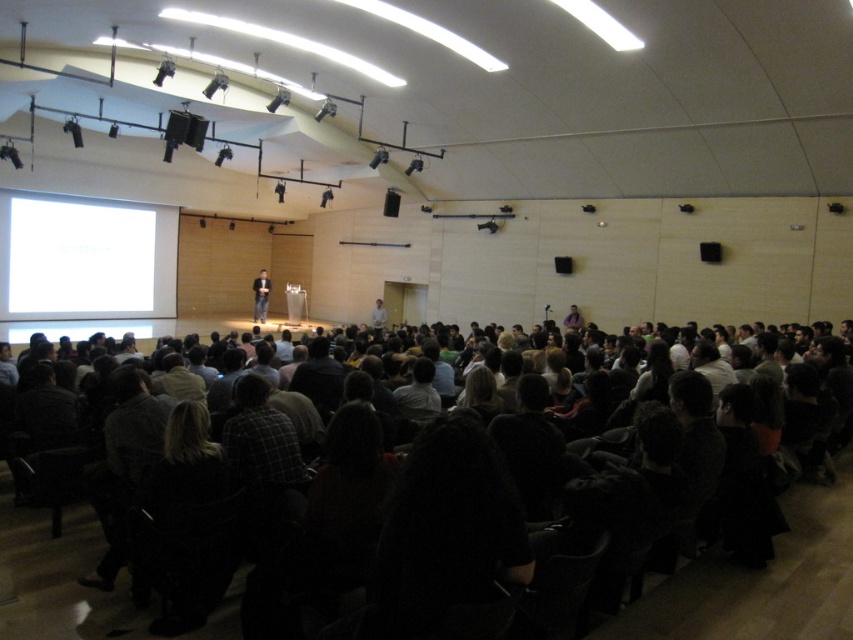
Question: Can you confirm if dark clothing crowd at center is positioned above dark suit at center?

Choices:
 (A) no
 (B) yes

Answer: (A)

Question: Which is nearer to the dark clothing crowd at center?

Choices:
 (A) white glossy projection screen at left
 (B) dark suit at center

Answer: (A)

Question: Which point appears closest to the camera in this image?

Choices:
 (A) (73, 227)
 (B) (260, 285)
 (C) (799, 628)

Answer: (C)

Question: Observing the image, what is the correct spatial positioning of dark clothing crowd at center in reference to white glossy projection screen at left?

Choices:
 (A) right
 (B) left

Answer: (A)

Question: Which object is positioned farthest from the dark suit at center?

Choices:
 (A) dark clothing crowd at center
 (B) white glossy projection screen at left

Answer: (A)

Question: Can you confirm if white glossy projection screen at left is positioned to the left of dark suit at center?

Choices:
 (A) yes
 (B) no

Answer: (A)